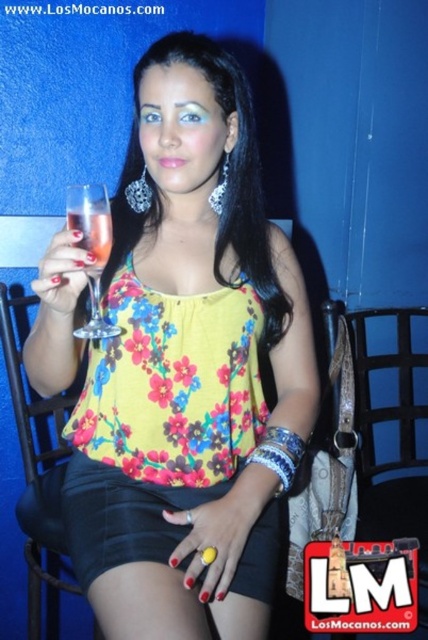
Question: Considering the real-world distances, which object is farthest from the black leather chair at left?

Choices:
 (A) matte glass at left
 (B) black leather chair at right
 (C) clear glass at upper left
 (D) yellow matte ring at lower center

Answer: (B)

Question: Considering the real-world distances, which object is closest to the black leather chair at left?

Choices:
 (A) matte glass at left
 (B) black leather chair at right
 (C) clear glass at upper left
 (D) floral print blouse at center

Answer: (D)

Question: Does black leather chair at left have a smaller size compared to black leather chair at right?

Choices:
 (A) yes
 (B) no

Answer: (B)

Question: From the image, what is the correct spatial relationship of black leather chair at left in relation to matte glass at left?

Choices:
 (A) left
 (B) right

Answer: (A)

Question: Which object is positioned closest to the matte glass at left?

Choices:
 (A) black leather chair at left
 (B) floral print blouse at center

Answer: (B)

Question: Can you confirm if black leather chair at left is bigger than matte glass at left?

Choices:
 (A) no
 (B) yes

Answer: (B)